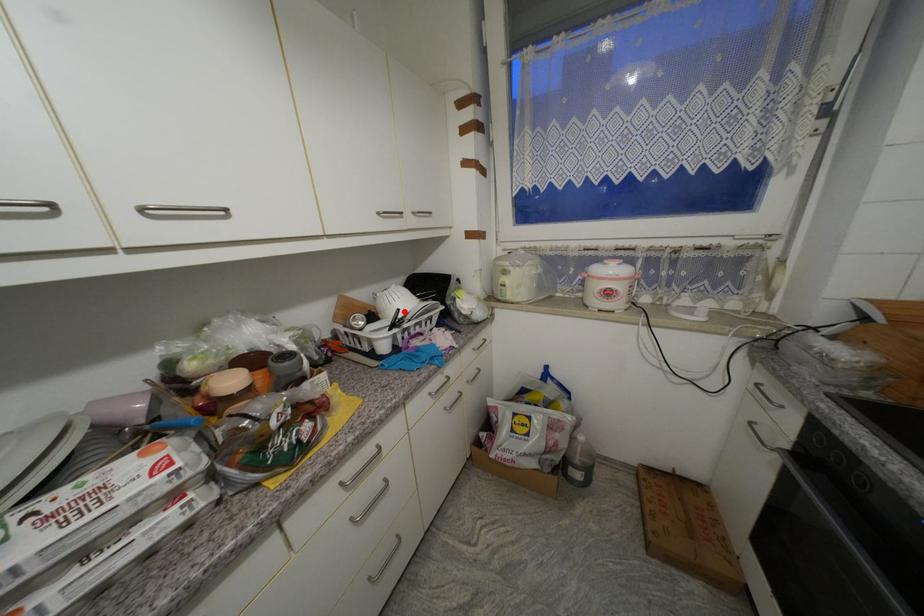
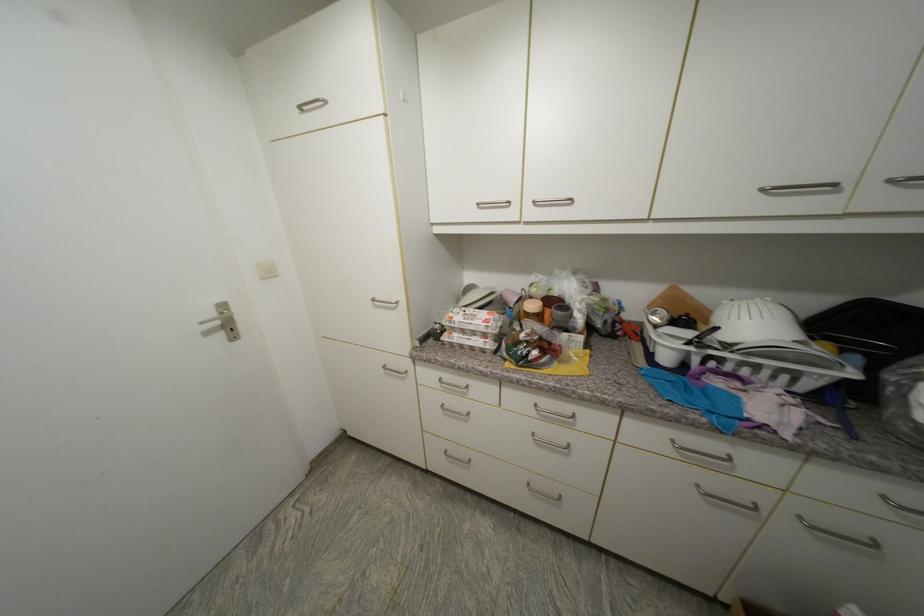
Find the pixel in the second image that matches the highlighted location in the first image.

(723, 330)